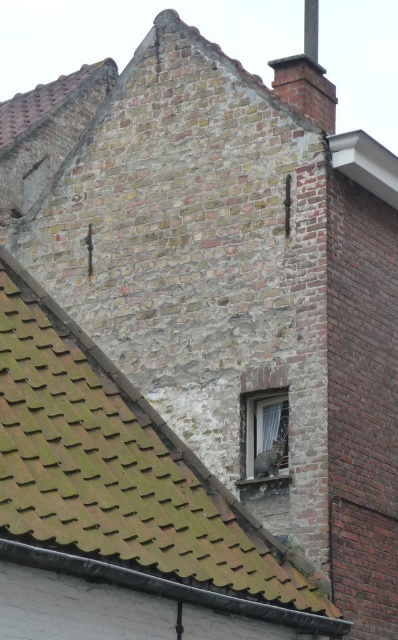
Question: Does brick chimney at upper right appear under white sheer curtain at center?

Choices:
 (A) no
 (B) yes

Answer: (A)

Question: Considering the relative positions of brown shingles at upper left and white sheer curtain at center in the image provided, where is brown shingles at upper left located with respect to white sheer curtain at center?

Choices:
 (A) above
 (B) below

Answer: (B)

Question: Which point is farther from the camera taking this photo?

Choices:
 (A) (261, 444)
 (B) (251, 529)
 (C) (327, 132)

Answer: (C)

Question: Where is brown shingles at upper left located in relation to white sheer curtain at center in the image?

Choices:
 (A) right
 (B) left

Answer: (B)

Question: Among these objects, which one is farthest from the camera?

Choices:
 (A) brick chimney at upper right
 (B) brown shingles at upper left

Answer: (A)

Question: Which object appears closest to the camera in this image?

Choices:
 (A) brown shingles at upper left
 (B) brick chimney at upper right
 (C) white sheer curtain at center

Answer: (A)